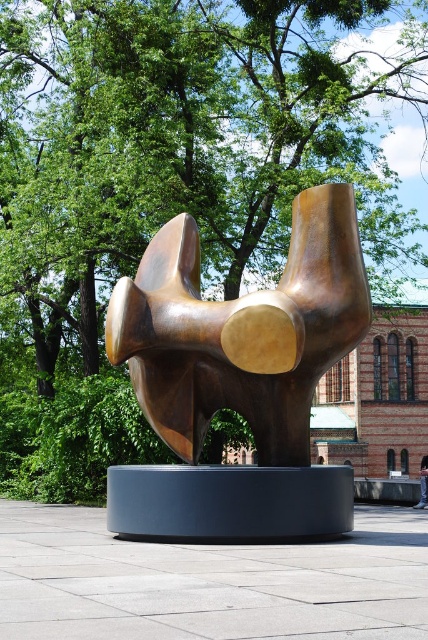
You are standing in the park and want to take a photo of the bronze sculpture at center. If you move 10 meters to the north, will the sculpture still be in the frame? Please explain your reasoning based on the sculpture location coordinates.

The bronze sculpture at center is located at coordinates point (238, 378). Since the question does not provide information about the camera field of view or the park layout beyond the sculpture and its coordinates, it is impossible to determine if moving 10 meters north would keep the sculpture in the frame. Additional details about the environment and camera specifications are needed for an accurate assessment.

You are a photographer planning to capture the bronze sculpture at center and the denim pants at lower right in a single frame. Considering their sizes, which object would you need to position closer to the camera to ensure both fit within the frame?

The bronze sculpture at center occupies less space than the denim pants at lower right, so you would need to position the denim pants at lower right closer to the camera to ensure both fit within the frame.